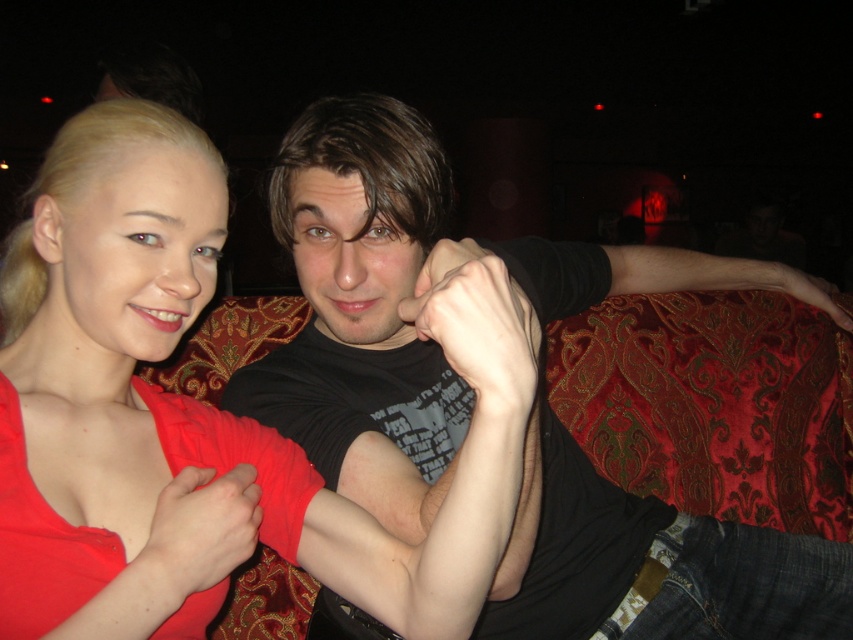
Does point (86, 420) come farther from viewer compared to point (415, 196)?

No.

Between point (212, 202) and point (556, 580), which one is positioned behind?

The point (556, 580) is more distant.

Locate an element on the screen. The width and height of the screenshot is (853, 640). matte red dress at center is located at coordinates (112, 333).